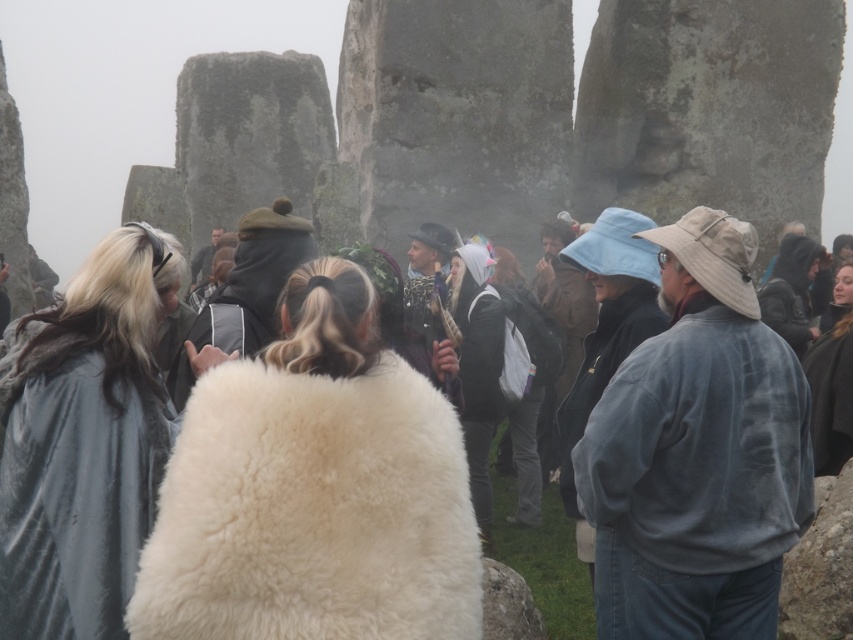
Question: Which point is farther from the camera taking this photo?

Choices:
 (A) (550, 624)
 (B) (212, 456)
 (C) (785, 332)

Answer: (C)

Question: Does denim jacket at center have a larger size compared to dark gray hooded jacket at center?

Choices:
 (A) yes
 (B) no

Answer: (A)

Question: Is velvet gray cloak at left above white woolen coat at center?

Choices:
 (A) no
 (B) yes

Answer: (B)

Question: Which point is closer to the camera?

Choices:
 (A) (567, 531)
 (B) (99, 620)

Answer: (B)

Question: Can you confirm if denim jacket at center is thinner than velvet gray cloak at left?

Choices:
 (A) yes
 (B) no

Answer: (B)

Question: Which of the following is the closest to the observer?

Choices:
 (A) (408, 400)
 (B) (126, 356)
 (C) (816, 253)

Answer: (A)